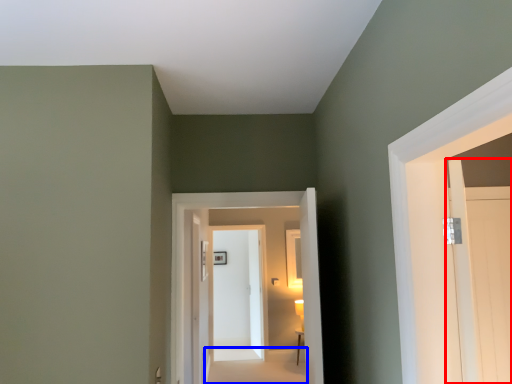
Question: Which of the following is the farthest to the observer, door (highlighted by a red box) or path (highlighted by a blue box)?

Choices:
 (A) door
 (B) path

Answer: (B)